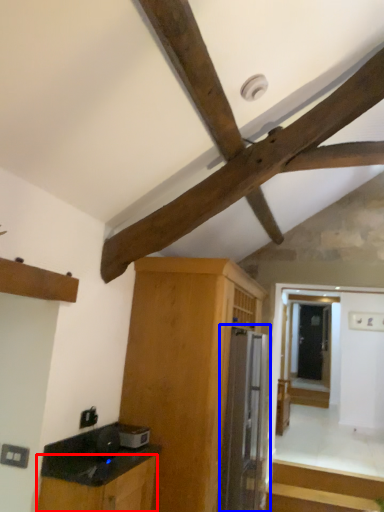
Question: Which of the following is the farthest to the observer, cabinetry (highlighted by a red box) or appliance (highlighted by a blue box)?

Choices:
 (A) cabinetry
 (B) appliance

Answer: (B)